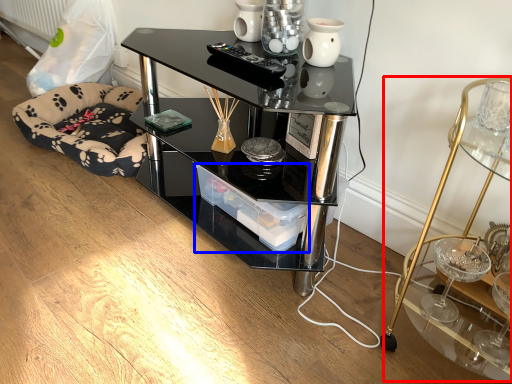
Question: Which object is closer to the camera taking this photo, cocktail table (highlighted by a red box) or glass box (highlighted by a blue box)?

Choices:
 (A) cocktail table
 (B) glass box

Answer: (A)